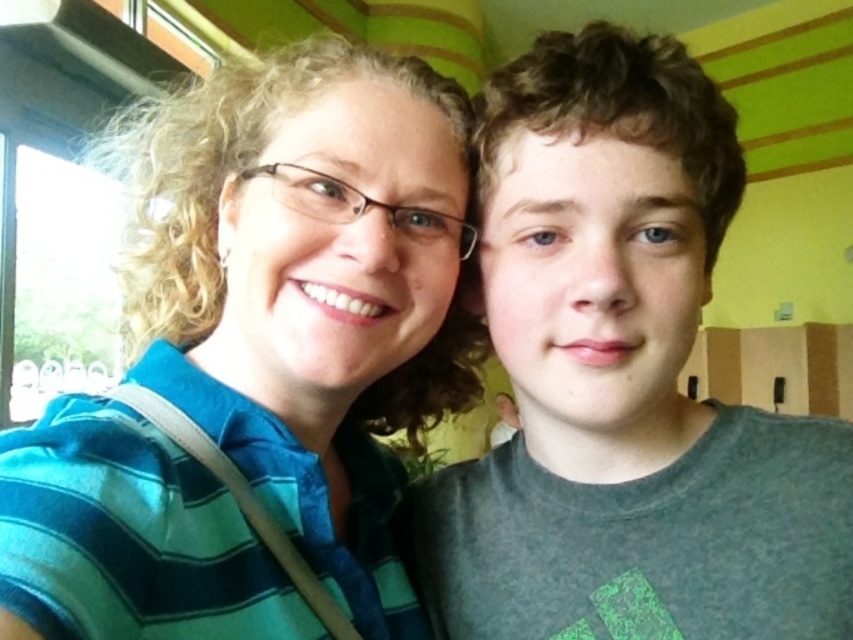
You are a photographer standing 15 inches away from the blue striped shirt at upper left. Can you take a clear photo of it without moving closer?

The blue striped shirt at upper left and viewer are 14.93 inches apart from each other, so you are close enough to take a clear photo without moving closer.

You are an interior designer observing the image. You need to determine the spatial relationship between the blue striped shirt at upper left and the matte gray shirt at right. Which one is positioned higher in the image?

The blue striped shirt at upper left is positioned higher than the matte gray shirt at right in the image.

You are standing in a room with a blue striped shirt at upper left and a matte gray shirt at right. Which shirt is positioned more to the left side of the room?

The blue striped shirt at upper left is positioned more to the left side of the room.